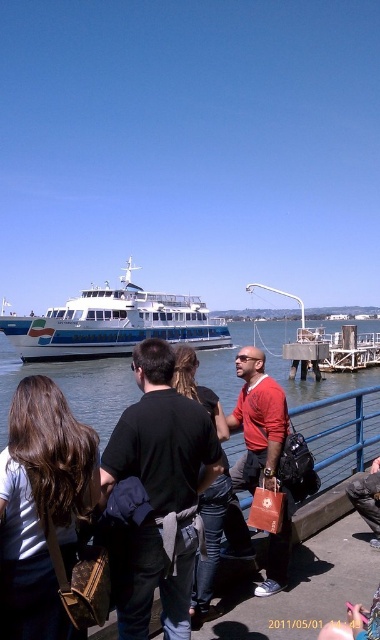
Question: Is black matte shirt at center below black leather jacket at center?

Choices:
 (A) no
 (B) yes

Answer: (B)

Question: Which of these objects is positioned closest to the black matte shirt at center?

Choices:
 (A) clear blue water at center
 (B) matte brown purse at left
 (C) black leather jacket at center

Answer: (C)

Question: Which point appears closest to the camera in this image?

Choices:
 (A) (55, 396)
 (B) (239, 388)
 (C) (99, 321)
 (D) (207, 515)

Answer: (A)

Question: Which object is farther from the camera taking this photo?

Choices:
 (A) white glossy ferry at center
 (B) black matte shirt at center
 (C) black leather jacket at center
 (D) matte brown purse at left

Answer: (A)

Question: Does matte brown purse at left have a greater width compared to clear blue water at center?

Choices:
 (A) no
 (B) yes

Answer: (A)

Question: Observing the image, what is the correct spatial positioning of black matte shirt at center in reference to black leather jacket at center?

Choices:
 (A) right
 (B) left

Answer: (B)